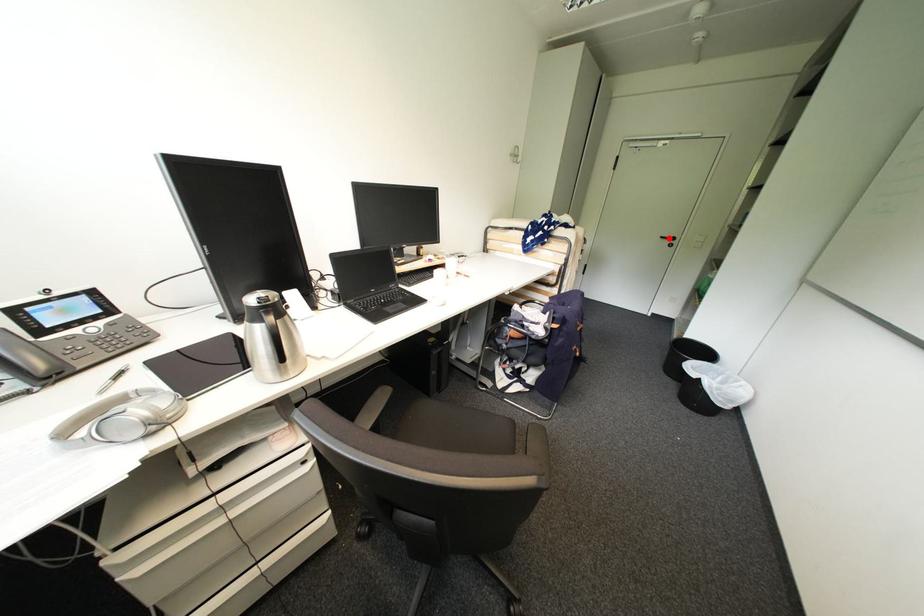
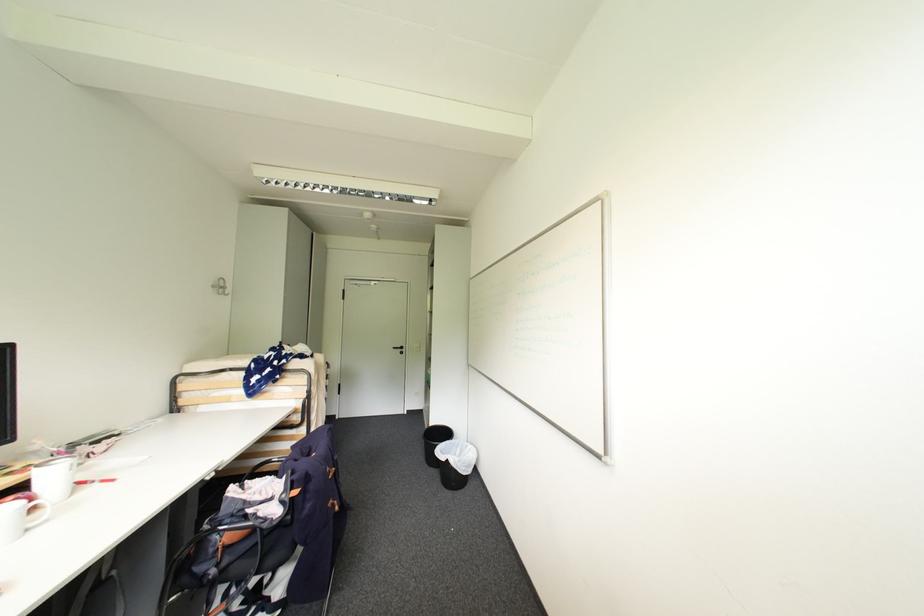
Question: I am providing you with two images of the same scene from different viewpoints. Given a red point in image1, look at the same physical point in image2. Is it:

Choices:
 (A) Closer to the viewpoint
 (B) Farther from the viewpoint

Answer: (B)